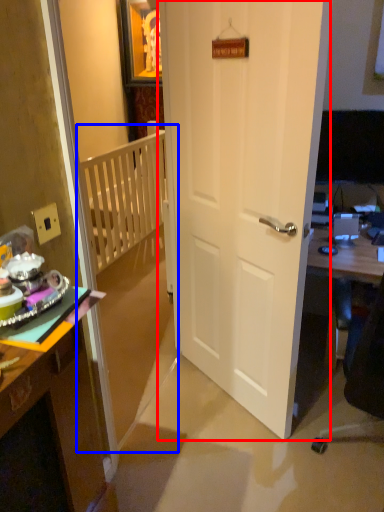
Question: Which point is closer to the camera, door (highlighted by a red box) or bunk bed (highlighted by a blue box)?

Choices:
 (A) door
 (B) bunk bed

Answer: (B)